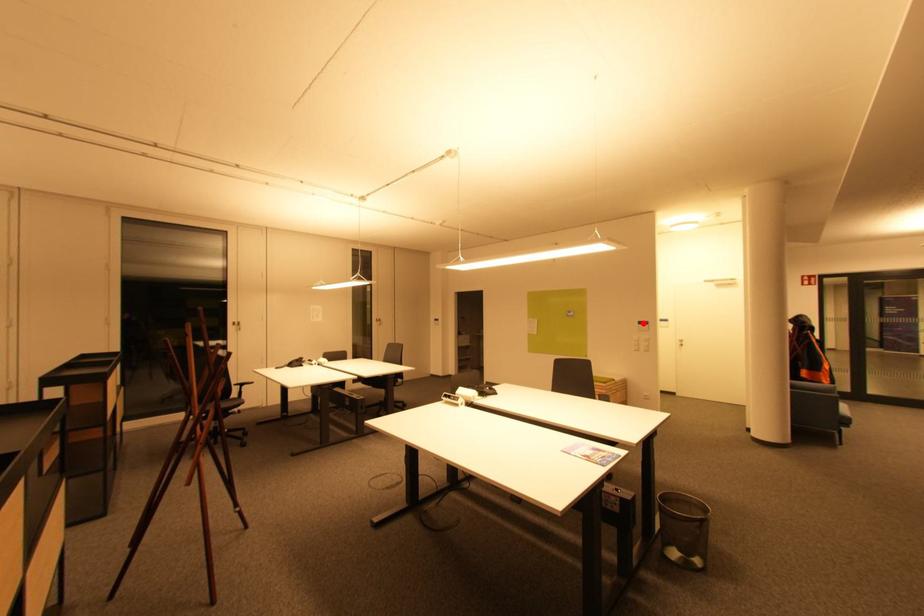
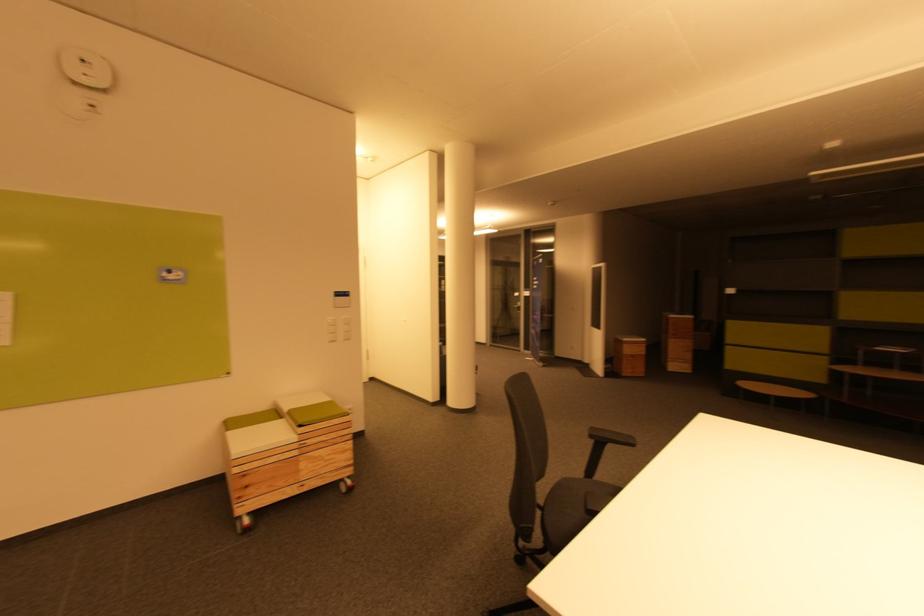
Question: I am providing you with two images of the same scene from different viewpoints. A red point is marked on the first image. Is the red point's position out of view in image 2?

Choices:
 (A) Yes
 (B) No

Answer: (B)